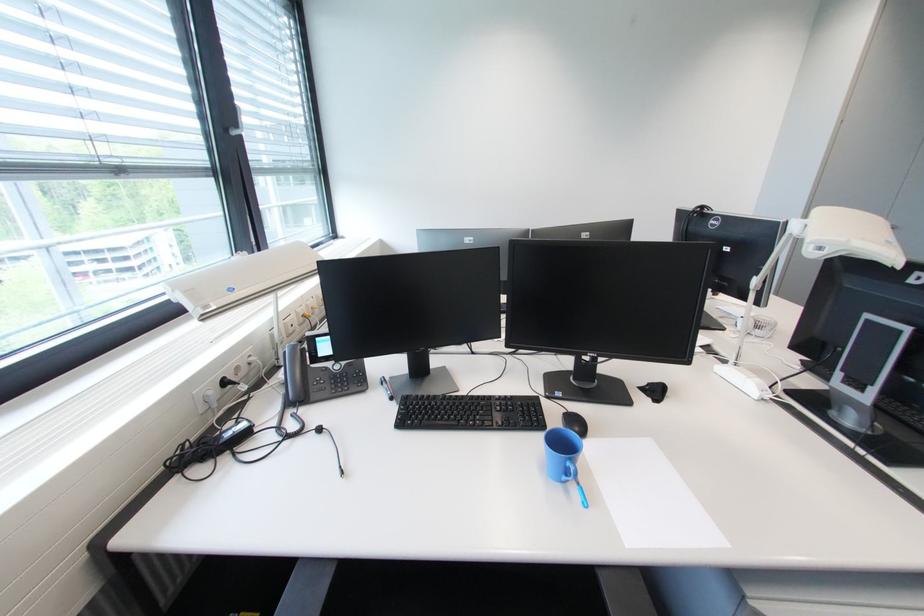
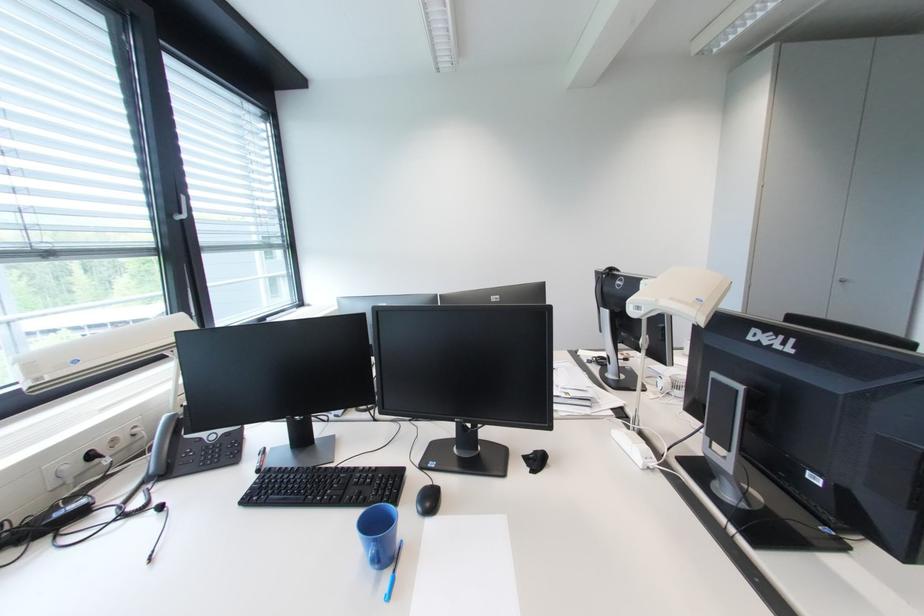
Find the pixel in the second image that matches point (575, 464) in the first image.

(379, 546)